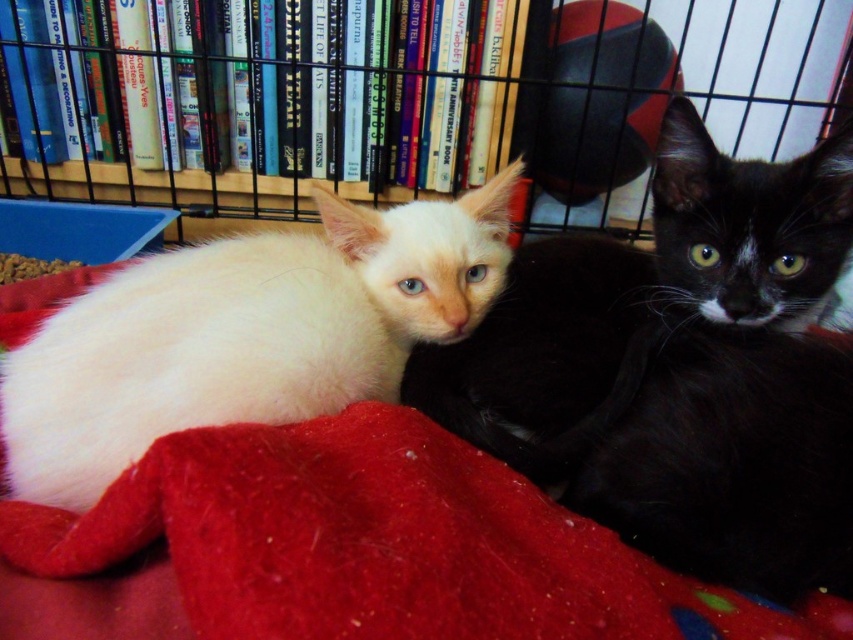
Question: Does fuzzy red blanket at center appear under wooden bookshelf at upper center?

Choices:
 (A) no
 (B) yes

Answer: (B)

Question: Which object appears closest to the camera in this image?

Choices:
 (A) fuzzy red blanket at center
 (B) white fur cat at center
 (C) wooden bookshelf at upper center
 (D) white fluffy cat at left

Answer: (A)

Question: Observing the image, what is the correct spatial positioning of fuzzy red blanket at center in reference to white fluffy cat at left?

Choices:
 (A) left
 (B) right

Answer: (B)

Question: Which of the following is the closest to the observer?

Choices:
 (A) white fluffy cat at left
 (B) fuzzy red blanket at center

Answer: (B)

Question: Which of the following is the closest to the observer?

Choices:
 (A) white fur cat at center
 (B) fuzzy red blanket at center
 (C) white fluffy cat at left

Answer: (B)

Question: Can you confirm if fuzzy red blanket at center is positioned below white fluffy cat at left?

Choices:
 (A) yes
 (B) no

Answer: (A)